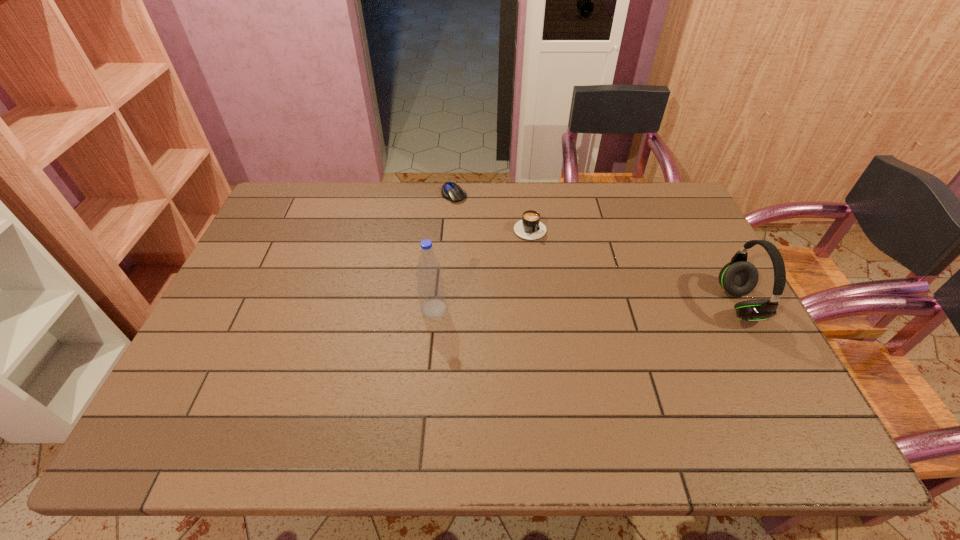
Locate an element on the screen. The width and height of the screenshot is (960, 540). vacant space that's between the farthest object and the headset is located at coordinates (597, 249).

Where is `free space between the tallest object and the farthest object`? This screenshot has height=540, width=960. free space between the tallest object and the farthest object is located at coordinates (444, 251).

I want to click on the second closest object to the second farthest object, so pos(431,291).

Identify which object is the second closest to the third object from left to right. Please provide its 2D coordinates. Your answer should be formatted as a tuple, i.e. [(x, y)], where the tuple contains the x and y coordinates of a point satisfying the conditions above.

[(431, 291)]

At what (x,y) coordinates should I click in order to perform the action: click on vacant space that satisfies the following two spatial constraints: 1. on the front side of the headset; 2. on the ear cups of the computer mouse. Please return your answer as a coordinate pair (x, y). Looking at the image, I should click on (446, 305).

Image resolution: width=960 pixels, height=540 pixels. In order to click on free location that satisfies the following two spatial constraints: 1. on the back side of the tallest object; 2. on the left side of the second shortest object in this screenshot , I will do `click(442, 226)`.

This screenshot has height=540, width=960. I want to click on free point that satisfies the following two spatial constraints: 1. on the front side of the farthest object; 2. on the ear cups of the rightmost object, so pos(446,305).

The height and width of the screenshot is (540, 960). Find the location of `vacant area in the image that satisfies the following two spatial constraints: 1. on the front side of the cappuccino; 2. on the ear cups of the second tallest object`. vacant area in the image that satisfies the following two spatial constraints: 1. on the front side of the cappuccino; 2. on the ear cups of the second tallest object is located at coordinates coord(539,305).